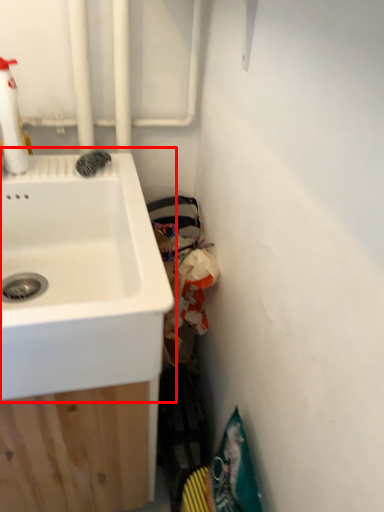
Question: Where is sink (annotated by the red box) located in relation to cleaning product in the image?

Choices:
 (A) left
 (B) right

Answer: (B)